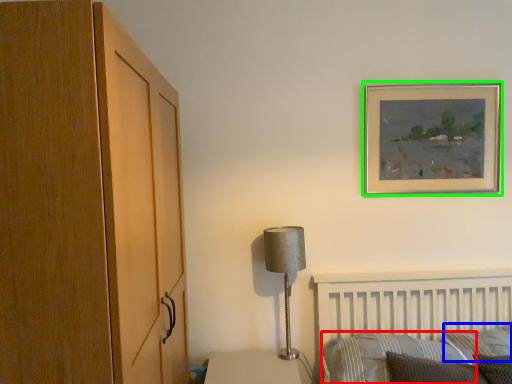
Question: Based on their relative distances, which object is nearer to pillow (highlighted by a red box)? Choose from pillow (highlighted by a blue box) and picture frame (highlighted by a green box).

Choices:
 (A) pillow
 (B) picture frame

Answer: (A)